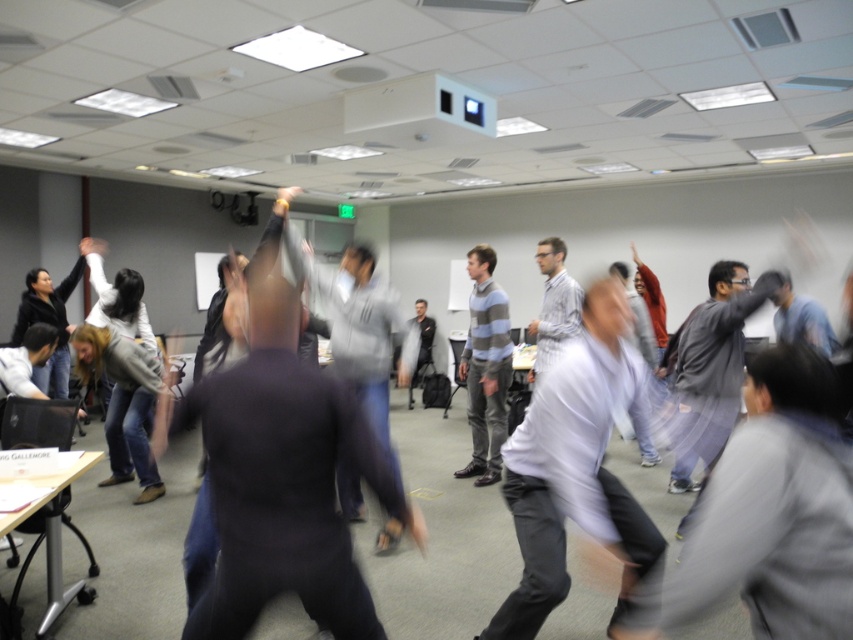
You are standing in the room and see both the white shirt at center and the striped sweater at center. Which one is positioned more to the right?

The white shirt at center is positioned more to the right than the striped sweater at center.

You are standing in the room and want to find the point at coordinates (575, 467). Where is this point located?

The point at coordinates (575, 467) is located on the white shirt at center.